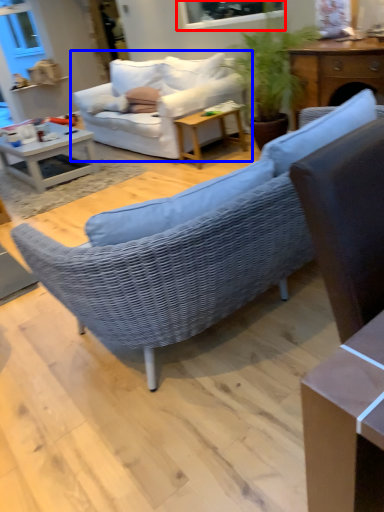
Question: Which object is further to the camera taking this photo, window screen (highlighted by a red box) or studio couch (highlighted by a blue box)?

Choices:
 (A) window screen
 (B) studio couch

Answer: (B)